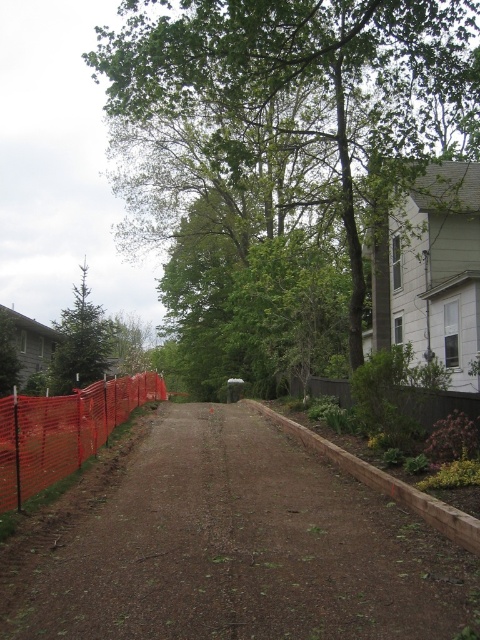
In the scene shown: Between orange mesh fence at left and brown wood fence at lower right, which one has less height?

brown wood fence at lower right

What do you see at coordinates (62, 432) in the screenshot? This screenshot has height=640, width=480. I see `orange mesh fence at left` at bounding box center [62, 432].

Image resolution: width=480 pixels, height=640 pixels. What are the coordinates of `orange mesh fence at left` in the screenshot? It's located at (62, 432).

The height and width of the screenshot is (640, 480). I want to click on orange mesh fence at left, so click(62, 432).

Can you confirm if brown dirt track at center is thinner than green matte tree at left?

Correct, brown dirt track at center's width is less than green matte tree at left's.

Who is more forward, (201, 508) or (60, 369)?

Point (201, 508) is in front.

What do you see at coordinates (242, 548) in the screenshot? I see `brown dirt track at center` at bounding box center [242, 548].

At what (x,y) coordinates should I click in order to perform the action: click on brown dirt track at center. Please return your answer as a coordinate pair (x, y). The image size is (480, 640). Looking at the image, I should click on (242, 548).

Is point (166, 291) less distant than point (396, 385)?

That is False.

Does green leafy tree at center come in front of brown wood fence at lower right?

That is False.

Between point (156, 176) and point (427, 390), which one is positioned behind?

Positioned behind is point (156, 176).

The image size is (480, 640). Find the location of `green leafy tree at center`. green leafy tree at center is located at coordinates (285, 150).